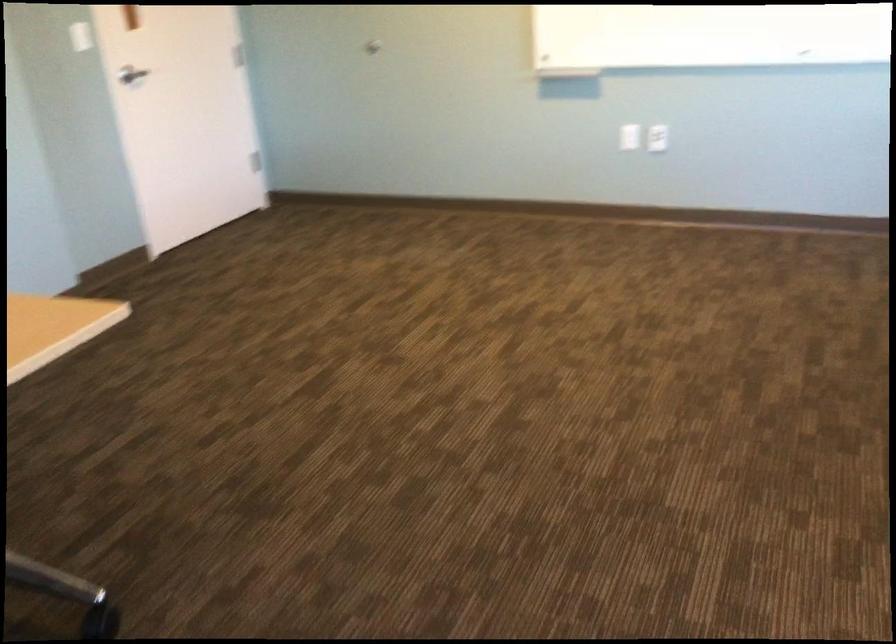
Where would you push the silver door handle? Please return your answer as a coordinate pair (x, y).

(131, 75)